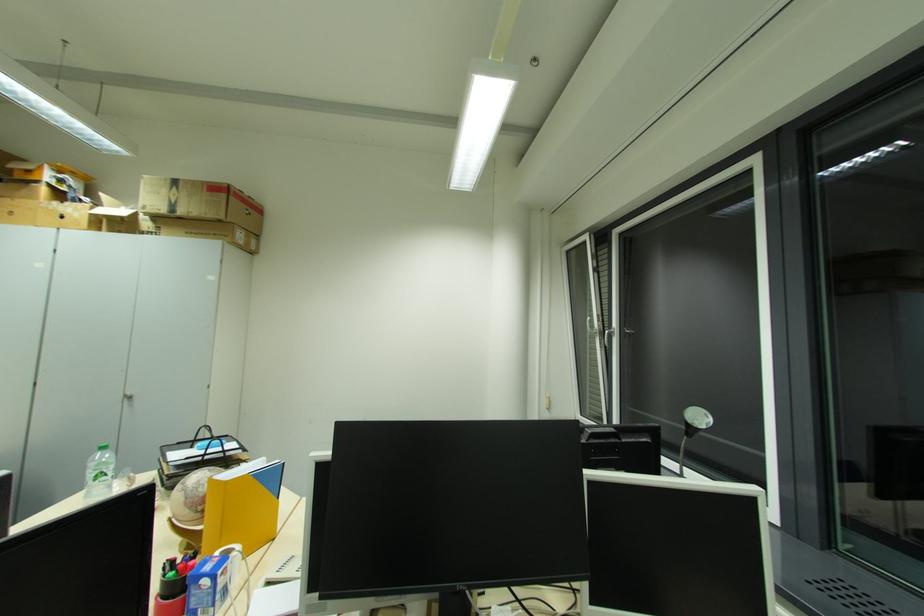
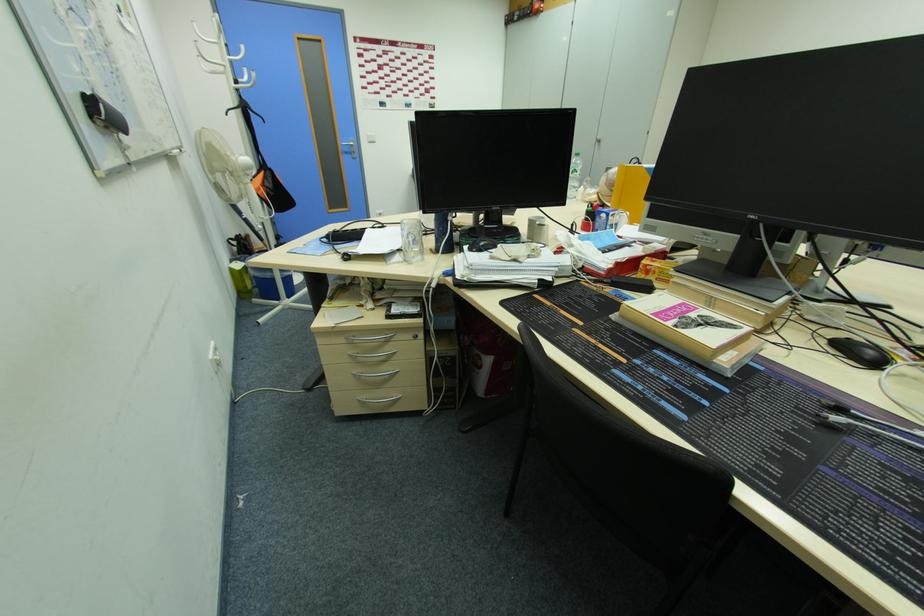
The first image is from the beginning of the video and the second image is from the end. How did the camera likely rotate when shooting the video?

The rotation direction of the camera is left-down.